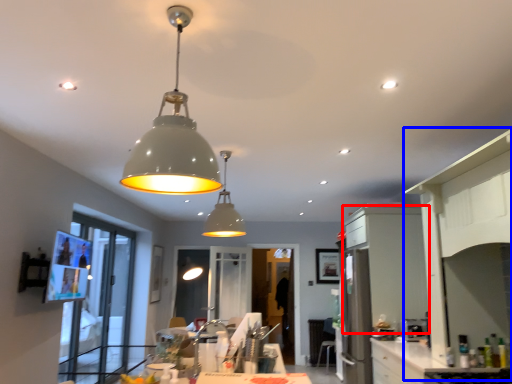
Question: Which object appears farthest to the camera in this image, cabinetry (highlighted by a red box) or side (highlighted by a blue box)?

Choices:
 (A) cabinetry
 (B) side

Answer: (A)